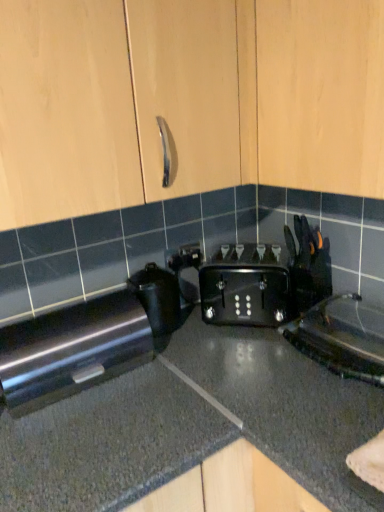
Question: From a real-world perspective, relative to satin black toaster at lower left, is black plastic kettle at lower right, the first appliance positioned from the right, vertically above or below?

Choices:
 (A) below
 (B) above

Answer: (A)

Question: Considering the positions of black plastic kettle at lower right, the first appliance positioned from the right, and satin black toaster at lower left in the image, is black plastic kettle at lower right, the first appliance positioned from the right, taller or shorter than satin black toaster at lower left?

Choices:
 (A) short
 (B) tall

Answer: (A)

Question: Considering the real-world distances, which object is farthest from the light wood cabinet at upper center?

Choices:
 (A) satin black toaster at lower left
 (B) black plastic toaster at center, which ranks as the 2th appliance in right-to-left order
 (C) black plastic kettle at lower right, the first appliance positioned from the right
 (D) black granite countertop at center

Answer: (A)

Question: Which object is positioned farthest from the satin black toaster at lower left?

Choices:
 (A) black plastic kettle at lower right, the 2th appliance in the left-to-right sequence
 (B) black granite countertop at center
 (C) black plastic toaster at center, which ranks as the 2th appliance in right-to-left order
 (D) light wood cabinet at upper center

Answer: (D)